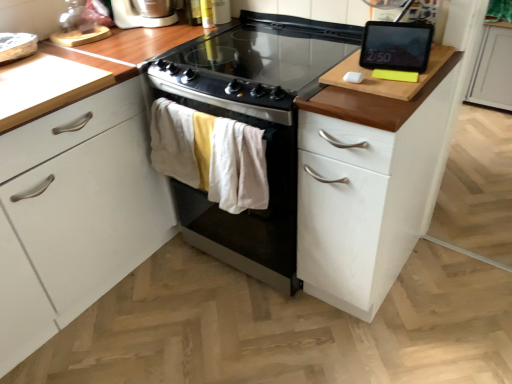
Find the location of `black glass cooktop at center`. black glass cooktop at center is located at coordinates (269, 52).

The width and height of the screenshot is (512, 384). What do you see at coordinates (396, 46) in the screenshot?
I see `black glossy tablet at upper right` at bounding box center [396, 46].

You are a GUI agent. You are given a task and a screenshot of the screen. Output one action in this format:
    pyautogui.click(x=<x>, y=<y>)
    Task: Click on the white wood cabinet at right
    The width and height of the screenshot is (512, 384).
    Given the screenshot: What is the action you would take?
    pyautogui.click(x=367, y=187)

In terms of width, does white wood cabinet at right look wider or thinner when compared to black glass-top oven at center?

Considering their sizes, white wood cabinet at right looks slimmer than black glass-top oven at center.

Based on the photo, considering the sizes of objects white wood cabinet at right and black glass-top oven at center in the image provided, who is smaller, white wood cabinet at right or black glass-top oven at center?

white wood cabinet at right is smaller.

Is point (362, 181) closer to camera compared to point (285, 160)?

Yes, point (362, 181) is closer to viewer.

Is white wood cabinet at right next to black glass-top oven at center and touching it?

No, white wood cabinet at right is not beside black glass-top oven at center.

Is the depth of white wood cabinet at right less than that of black glass cooktop at center?

Yes, it is.

Is white wood cabinet at right wider or thinner than black glass cooktop at center?

Considering their sizes, white wood cabinet at right looks slimmer than black glass cooktop at center.

From the image's perspective, is white wood cabinet at right over black glass cooktop at center?

No, from the image's perspective, white wood cabinet at right is not on top of black glass cooktop at center.

Identify the location of cabinetry in front of the black glass cooktop at center. (367, 187).

Is black glass cooktop at center directly adjacent to black glossy tablet at upper right?

No, black glass cooktop at center is not in contact with black glossy tablet at upper right.

Which is in front, black glass cooktop at center or black glossy tablet at upper right?

black glass cooktop at center.

In the scene shown: What's the angular difference between black glass cooktop at center and black glossy tablet at upper right's facing directions?

12 degrees.

Identify the location of kitchen appliance on the right of black glass cooktop at center. The image size is (512, 384). (396, 46).

Is black glass cooktop at center not inside white wood cabinet at right?

Absolutely, black glass cooktop at center is external to white wood cabinet at right.

Is black glass cooktop at center looking in the opposite direction of white wood cabinet at right?

black glass cooktop at center is not turned away from white wood cabinet at right.

From a real-world perspective, is black glass cooktop at center under white wood cabinet at right?

No, from a real-world perspective, black glass cooktop at center is not under white wood cabinet at right.

Is black glass-top oven at center positioned with its back to white wood cabinet at right?

No.

Considering the sizes of objects black glass-top oven at center and white wood cabinet at right in the image provided, who is thinner, black glass-top oven at center or white wood cabinet at right?

Thinner between the two is white wood cabinet at right.

Is black glass-top oven at center to the left or to the right of white wood cabinet at right in the image?

black glass-top oven at center is positioned on white wood cabinet at right's left side.

From the image's perspective, between black glass-top oven at center and white wood cabinet at right, which one is located above?

black glass-top oven at center.

Is there a large distance between black glossy tablet at upper right and black glass-top oven at center?

Actually, black glossy tablet at upper right and black glass-top oven at center are a little close together.

In the scene shown: In terms of height, does black glossy tablet at upper right look taller or shorter compared to black glass-top oven at center?

In the image, black glossy tablet at upper right appears to be shorter than black glass-top oven at center.

Which object is closer to the camera, black glossy tablet at upper right or black glass-top oven at center?

Positioned in front is black glossy tablet at upper right.

Is white wood cabinet at right turned away from white plastic toaster at upper left?

Answer: white wood cabinet at right is not turned away from white plastic toaster at upper left.

This screenshot has height=384, width=512. Identify the location of home appliance to the left of white wood cabinet at right. (143, 13).

Is white wood cabinet at right smaller than white plastic toaster at upper left?

No.

From a real-world perspective, relative to white plastic toaster at upper left, is white wood cabinet at right vertically above or below?

white wood cabinet at right is situated lower than white plastic toaster at upper left in the real world.

You are a GUI agent. You are given a task and a screenshot of the screen. Output one action in this format:
    pyautogui.click(x=<x>, y=<y>)
    Task: Click on the cabinetry in front of the black glass-top oven at center
    The height and width of the screenshot is (384, 512).
    Given the screenshot: What is the action you would take?
    [x=367, y=187]

Where is `gas stove above the white wood cabinet at right (from the image's perspective)`? gas stove above the white wood cabinet at right (from the image's perspective) is located at coordinates tap(269, 52).

When comparing their distances from white wood cabinet at right, does black glass-top oven at center or white plastic toaster at upper left seem closer?

black glass-top oven at center is positioned closer to the anchor white wood cabinet at right.

From the image, which object appears to be nearer to white plastic toaster at upper left, black glass-top oven at center or black glossy tablet at upper right?

black glass-top oven at center is closer to white plastic toaster at upper left.

Looking at the image, which one is located further to white wood cabinet at right, black glass cooktop at center or black glass-top oven at center?

Among the two, black glass cooktop at center is located further to white wood cabinet at right.

Estimate the real-world distances between objects in this image. Which object is further from white plastic toaster at upper left, black glass-top oven at center or black glass cooktop at center?

black glass-top oven at center is positioned further to the anchor white plastic toaster at upper left.

Which object lies nearer to the anchor point black glass cooktop at center, white plastic toaster at upper left or white wood cabinet at right?

white wood cabinet at right is closer to black glass cooktop at center.

When comparing their distances from black glossy tablet at upper right, does black glass cooktop at center or black glass-top oven at center seem closer?

black glass cooktop at center is closer to black glossy tablet at upper right.

From the image, which object appears to be farther from black glass-top oven at center, white wood cabinet at right or black glossy tablet at upper right?

The object further to black glass-top oven at center is black glossy tablet at upper right.

Estimate the real-world distances between objects in this image. Which object is closer to black glass-top oven at center, white plastic toaster at upper left or black glossy tablet at upper right?

Based on the image, black glossy tablet at upper right appears to be nearer to black glass-top oven at center.

I want to click on oven between black glass cooktop at center and white wood cabinet at right vertically, so click(254, 126).

Where is `oven between black glass cooktop at center and black glossy tablet at upper right in the horizontal direction`? oven between black glass cooktop at center and black glossy tablet at upper right in the horizontal direction is located at coordinates (254, 126).

Image resolution: width=512 pixels, height=384 pixels. I want to click on gas stove between white plastic toaster at upper left and black glass-top oven at center in the vertical direction, so click(269, 52).

This screenshot has width=512, height=384. What are the coordinates of `oven between white plastic toaster at upper left and black glossy tablet at upper right in the horizontal direction` in the screenshot? It's located at (254, 126).